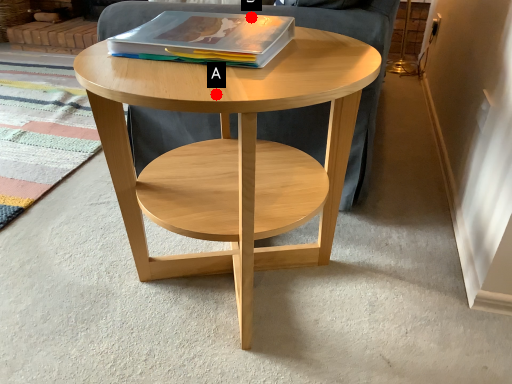
Question: Two points are circled on the image, labeled by A and B beside each circle. Which point is closer to the camera taking this photo?

Choices:
 (A) A is closer
 (B) B is closer

Answer: (A)